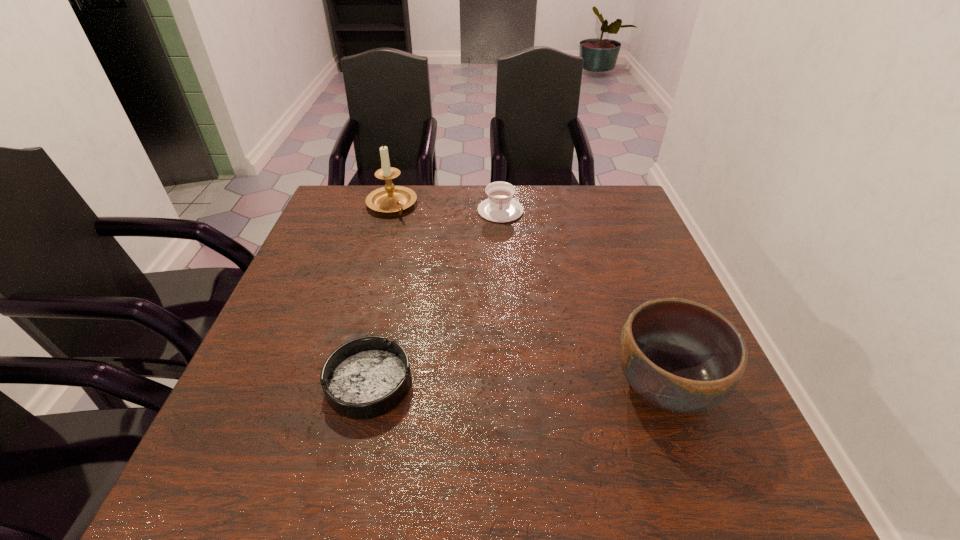
Find the location of a particular element. free space on the desktop that is between the shortest object and the rightmost object and is positioned on the handle side of the third tallest object is located at coordinates (511, 384).

Where is `free space on the desktop that is between the ashtray and the bowl and is positioned with a handle on the side of the tallest object`? The width and height of the screenshot is (960, 540). free space on the desktop that is between the ashtray and the bowl and is positioned with a handle on the side of the tallest object is located at coordinates (534, 384).